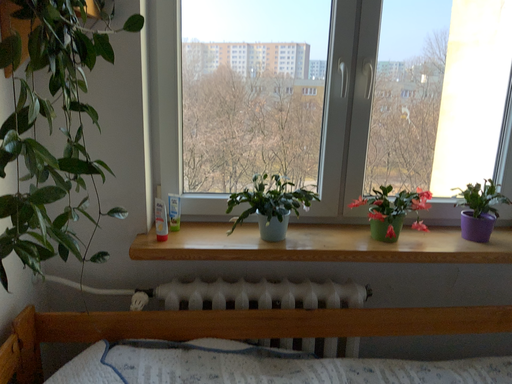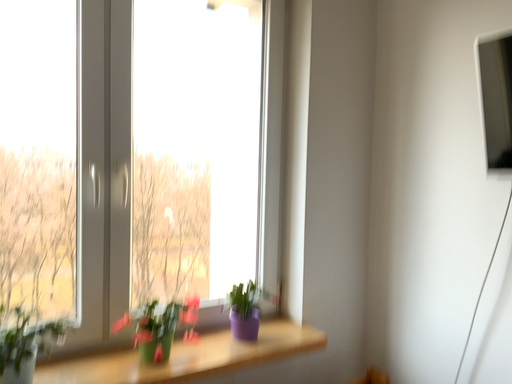
Question: Which way did the camera rotate in the video?

Choices:
 (A) rotated left
 (B) rotated right

Answer: (B)